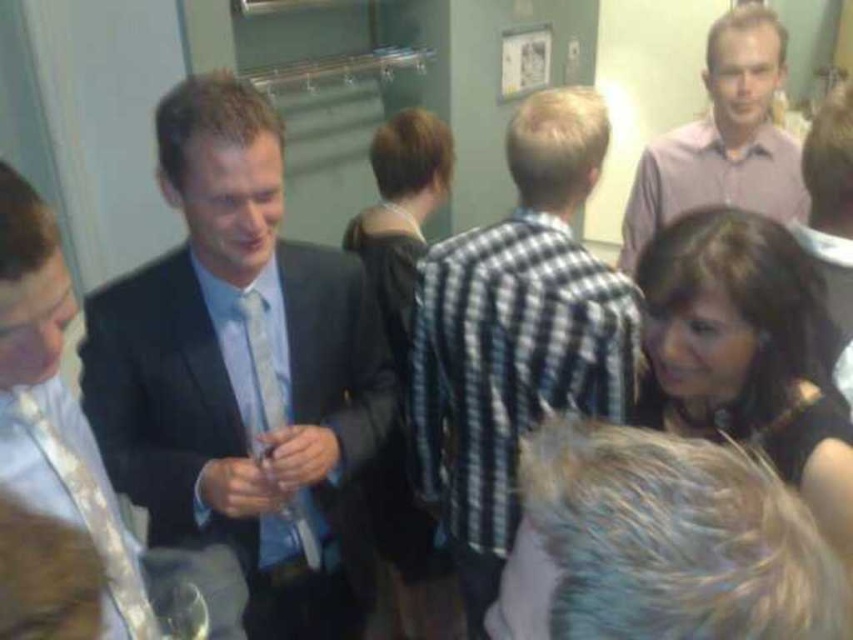
How much distance is there between matte black suit at center and checkered fabric shirt at center?

They are 16.66 inches apart.

This screenshot has width=853, height=640. I want to click on matte black suit at center, so click(242, 371).

The image size is (853, 640). Find the location of `matte black suit at center`. matte black suit at center is located at coordinates (242, 371).

Where is `matte black suit at center`? Image resolution: width=853 pixels, height=640 pixels. matte black suit at center is located at coordinates (242, 371).

Does matte black suit at center have a lesser width compared to pink shirt at upper right?

No.

Who is more distant from viewer, [358,298] or [779,173]?

The point [779,173] is behind.

Image resolution: width=853 pixels, height=640 pixels. I want to click on matte black suit at center, so click(x=242, y=371).

Between checkered fabric shirt at center and pink shirt at upper right, which one has more height?

checkered fabric shirt at center is taller.

What do you see at coordinates (515, 336) in the screenshot?
I see `checkered fabric shirt at center` at bounding box center [515, 336].

Locate an element on the screen. checkered fabric shirt at center is located at coordinates click(515, 336).